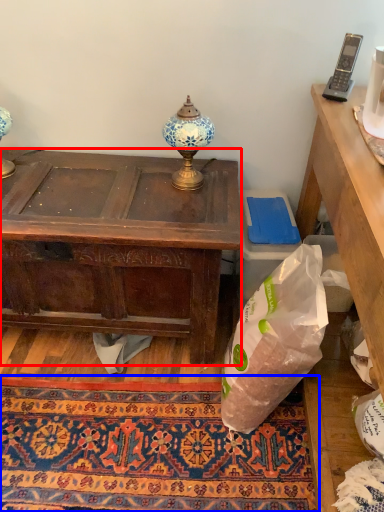
Question: Among these objects, which one is nearest to the camera, desk (highlighted by a red box) or mat (highlighted by a blue box)?

Choices:
 (A) desk
 (B) mat

Answer: (B)